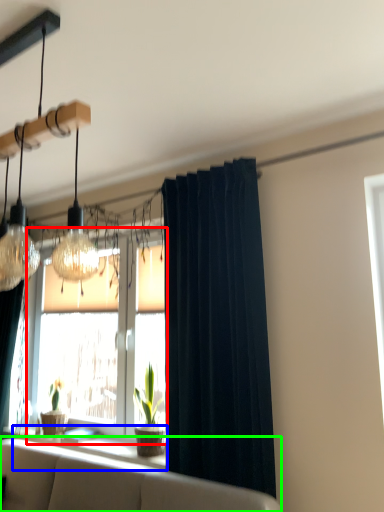
Question: Considering the real-world distances, which object is farthest from window (highlighted by a red box)? window sill (highlighted by a blue box) or studio couch (highlighted by a green box)?

Choices:
 (A) window sill
 (B) studio couch

Answer: (B)